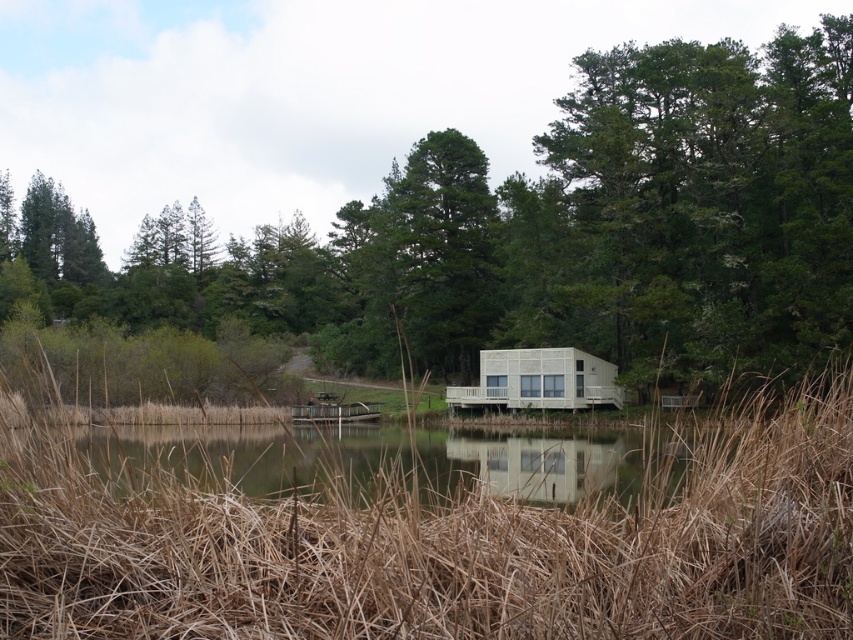
Question: Among these points, which one is farthest from the camera?

Choices:
 (A) (482, 291)
 (B) (189, 428)

Answer: (A)

Question: Does green leafy tree at center appear on the left side of clear water at center?

Choices:
 (A) no
 (B) yes

Answer: (B)

Question: Is green leafy tree at center positioned behind clear water at center?

Choices:
 (A) yes
 (B) no

Answer: (A)

Question: Which of the following is the closest to the observer?

Choices:
 (A) brown dry reed at center
 (B) clear water at center
 (C) green leafy tree at center

Answer: (A)

Question: Does brown dry reed at center lie in front of clear water at center?

Choices:
 (A) yes
 (B) no

Answer: (A)

Question: Among these points, which one is nearest to the camera?

Choices:
 (A) (585, 452)
 (B) (730, 272)
 (C) (816, 406)

Answer: (C)